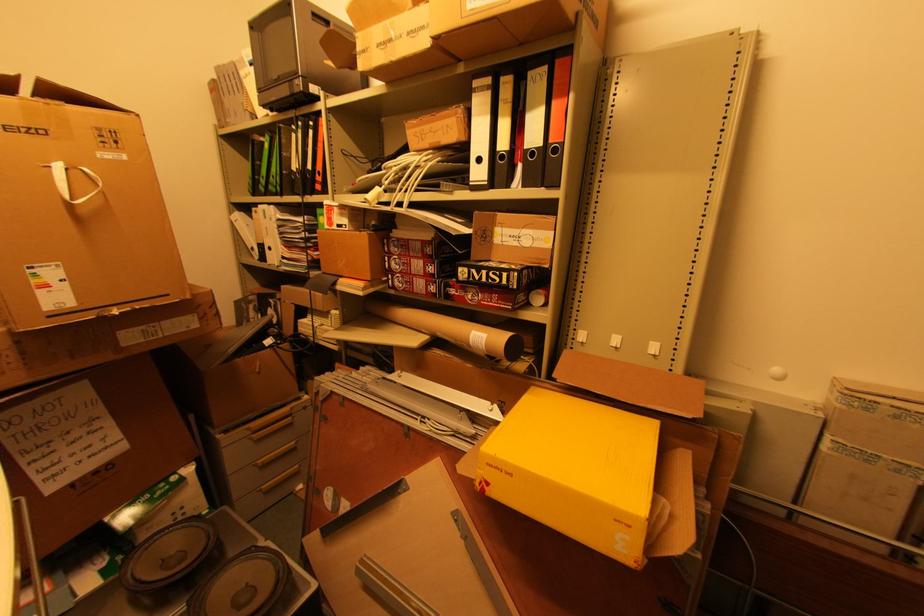
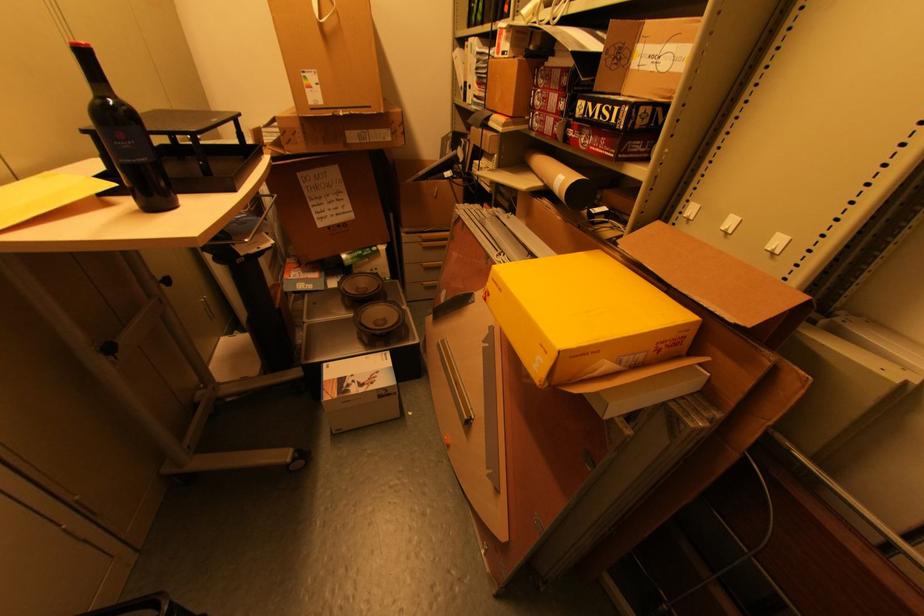
In the second image, find the point that corresponds to point 500,469 in the first image.

(499, 284)